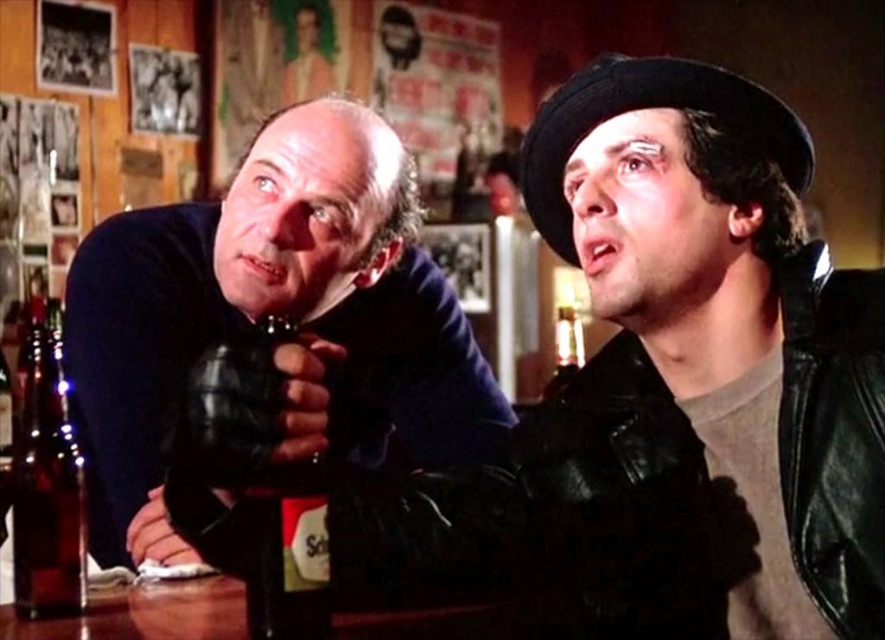
Question: Which point is closer to the camera taking this photo?

Choices:
 (A) (574, 344)
 (B) (152, 294)

Answer: (B)

Question: Which of these objects is positioned farthest from the dark blue sweater at left?

Choices:
 (A) translucent glass bottle at center
 (B) translucent glass bottle at lower left

Answer: (A)

Question: Is translucent glass bottle at lower left below translucent glass bottle at center?

Choices:
 (A) yes
 (B) no

Answer: (A)

Question: Does dark blue sweater at left appear on the left side of translucent glass bottle at lower left?

Choices:
 (A) yes
 (B) no

Answer: (B)

Question: Which object is the farthest from the dark blue sweater at left?

Choices:
 (A) translucent glass bottle at lower left
 (B) translucent glass bottle at center

Answer: (B)

Question: Is the position of translucent glass bottle at lower left more distant than that of translucent glass bottle at center?

Choices:
 (A) no
 (B) yes

Answer: (A)